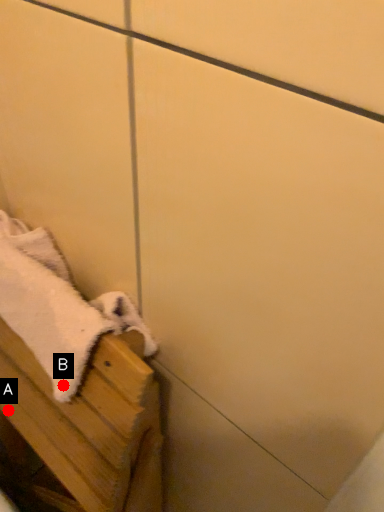
Question: Two points are circled on the image, labeled by A and B beside each circle. Which point appears closest to the camera in this image?

Choices:
 (A) A is closer
 (B) B is closer

Answer: (B)